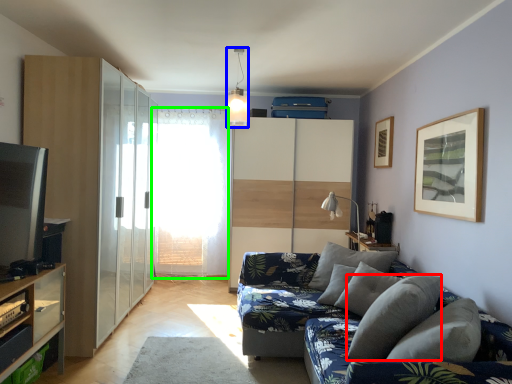
Question: Which object is positioned farthest from pillow (highlighted by a red box)? Select from light fixture (highlighted by a blue box) and window screen (highlighted by a green box).

Choices:
 (A) light fixture
 (B) window screen

Answer: (B)